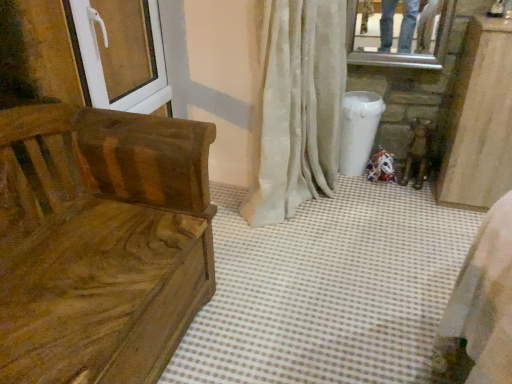
Question: Choose the correct answer: Is white plastic screen door at upper left inside wooden bench at left or outside it?

Choices:
 (A) outside
 (B) inside

Answer: (A)

Question: Looking at the image, does white plastic screen door at upper left seem bigger or smaller compared to wooden bench at left?

Choices:
 (A) small
 (B) big

Answer: (A)

Question: Based on their relative distances, which object is nearer to the white plastic screen door at upper left?

Choices:
 (A) wooden bench at left
 (B) white textured curtain at center

Answer: (A)

Question: Which of these objects is positioned farthest from the wooden bench at left?

Choices:
 (A) white textured curtain at center
 (B) white plastic screen door at upper left

Answer: (A)